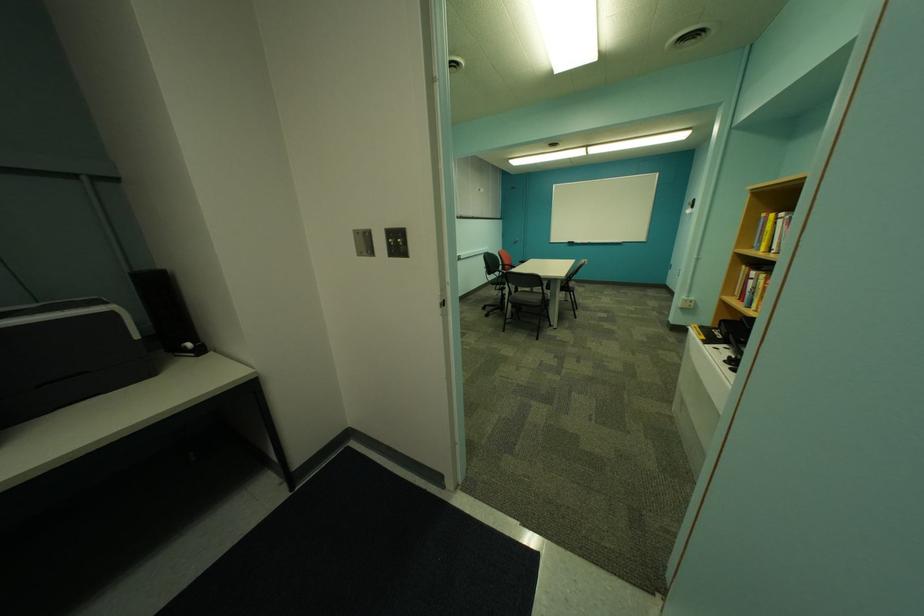
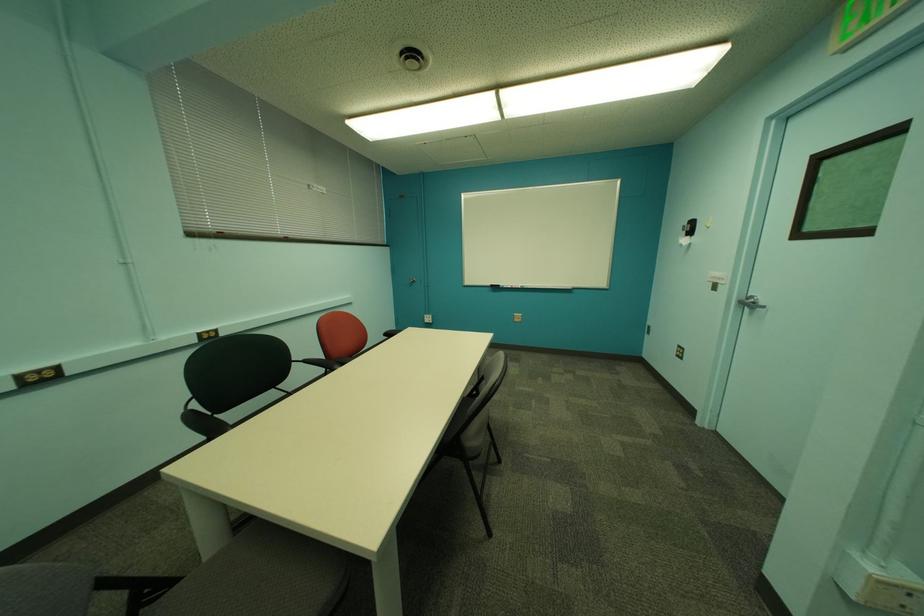
Which direction would the cameraman need to move to produce the second image?

The cameraman moved toward right, forward.